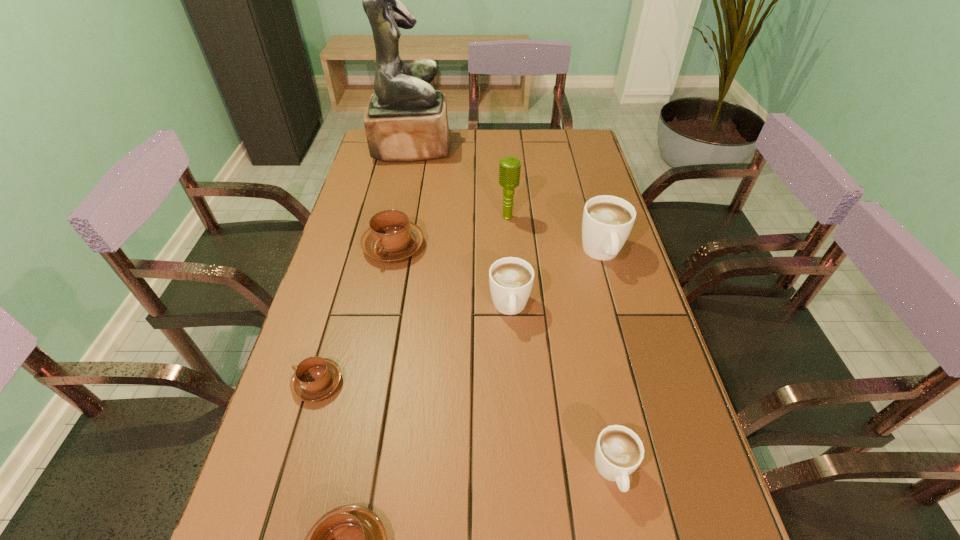
The width and height of the screenshot is (960, 540). What are the coordinates of `the smallest white cappuccino` in the screenshot? It's located at (619, 451).

I want to click on the shortest object, so click(x=315, y=378).

The image size is (960, 540). In order to click on the fourth farthest cappuccino in this screenshot , I will do `click(315, 378)`.

The height and width of the screenshot is (540, 960). Find the location of `blank area located 0.110m in a relaxed pose on the tallest object`. blank area located 0.110m in a relaxed pose on the tallest object is located at coordinates (479, 147).

Find the location of a particular element. blank space located on the left of the seventh shortest object is located at coordinates (478, 218).

At what (x,y) coordinates should I click in order to perform the action: click on free point located with the handle on the side of the biggest white cappuccino. Please return your answer as a coordinate pair (x, y). The image size is (960, 540). Looking at the image, I should click on (645, 407).

Where is `free spot located 0.250m with the handle on the side of the fourth cappuccino from left to right`? This screenshot has width=960, height=540. free spot located 0.250m with the handle on the side of the fourth cappuccino from left to right is located at coordinates (517, 428).

The height and width of the screenshot is (540, 960). Find the location of `free point located on the side of the biggest brown cappuccino with the handle`. free point located on the side of the biggest brown cappuccino with the handle is located at coordinates coord(384,295).

At what (x,y) coordinates should I click in order to perform the action: click on object that is positioned at the far edge. Please return your answer as a coordinate pair (x, y). This screenshot has width=960, height=540. Looking at the image, I should click on (406, 120).

Where is `sculpture at the left edge`? sculpture at the left edge is located at coordinates (406, 120).